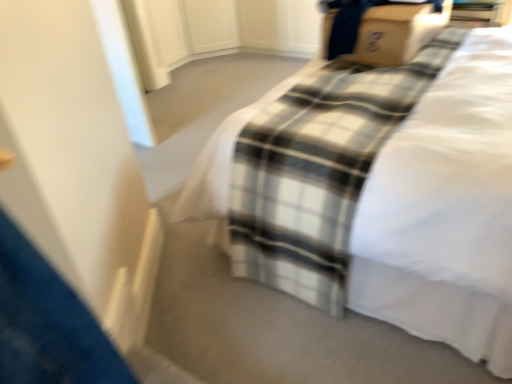
Question: Is white cotton bed at center in front of or behind cardboard box at upper right in the image?

Choices:
 (A) behind
 (B) front

Answer: (B)

Question: Looking at their shapes, would you say white cotton bed at center is wider or thinner than cardboard box at upper right?

Choices:
 (A) thin
 (B) wide

Answer: (B)

Question: In terms of height, does white cotton bed at center look taller or shorter compared to cardboard box at upper right?

Choices:
 (A) short
 (B) tall

Answer: (B)

Question: Does point (394, 11) appear closer or farther from the camera than point (470, 215)?

Choices:
 (A) closer
 (B) farther

Answer: (B)

Question: In terms of height, does cardboard box at upper right look taller or shorter compared to white cotton bed at center?

Choices:
 (A) short
 (B) tall

Answer: (A)

Question: From a real-world perspective, is cardboard box at upper right physically located above or below white cotton bed at center?

Choices:
 (A) below
 (B) above

Answer: (B)

Question: Looking at their shapes, would you say cardboard box at upper right is wider or thinner than white cotton bed at center?

Choices:
 (A) thin
 (B) wide

Answer: (A)